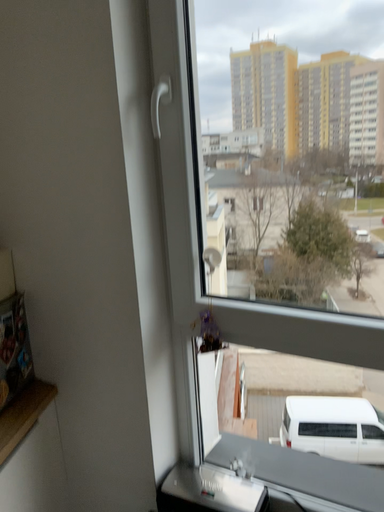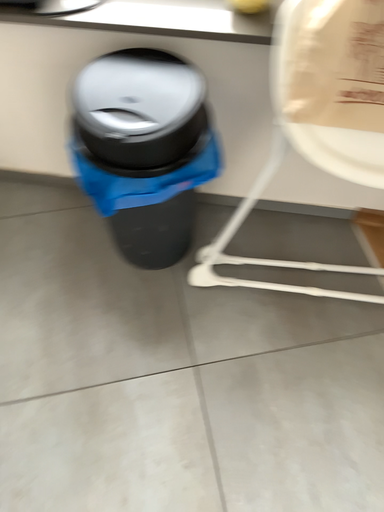
Question: How did the camera likely rotate when shooting the video?

Choices:
 (A) rotated downward
 (B) rotated upward

Answer: (A)